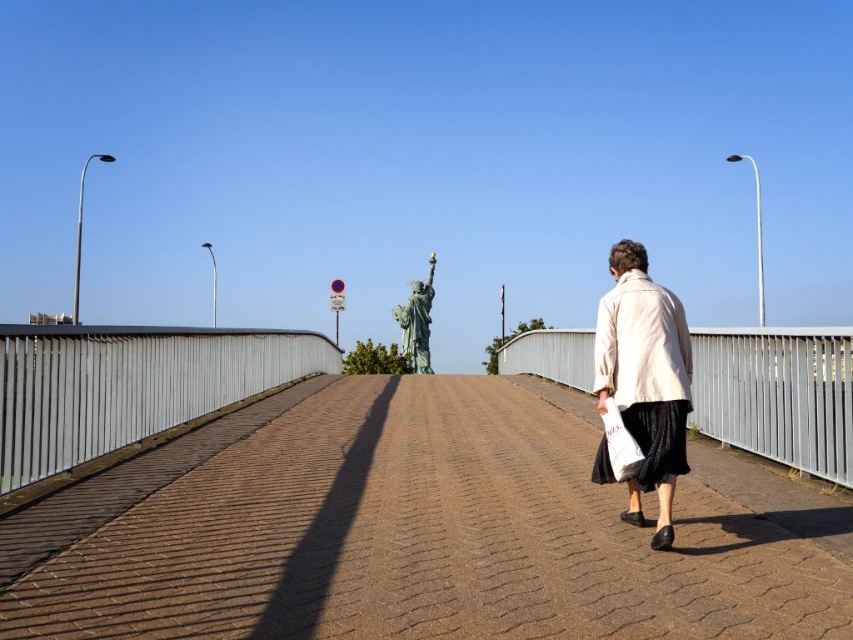
Question: Is brown textured pavement at center closer to the viewer compared to silver metallic rail at left?

Choices:
 (A) yes
 (B) no

Answer: (A)

Question: Which point is farther from the camera taking this photo?

Choices:
 (A) (257, 513)
 (B) (67, 385)

Answer: (B)

Question: Can you confirm if silver metallic rail at left is positioned to the right of white metal rail at right?

Choices:
 (A) yes
 (B) no

Answer: (B)

Question: From the image, what is the correct spatial relationship of brown textured pavement at center in relation to white metal rail at right?

Choices:
 (A) above
 (B) below

Answer: (B)

Question: Which is farther from the light beige fabric coat at right?

Choices:
 (A) white metal rail at right
 (B) silver metallic rail at left

Answer: (B)

Question: Based on their relative distances, which object is nearer to the brown textured pavement at center?

Choices:
 (A) silver metallic rail at left
 (B) light beige fabric coat at right
 (C) white metal rail at right

Answer: (B)